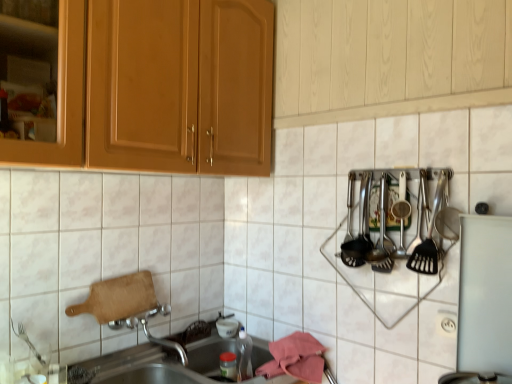
Question: Is white plastic electric outlet at lower right inside the boundaries of metallic stainless steel sink at lower left, or outside?

Choices:
 (A) inside
 (B) outside

Answer: (B)

Question: From a real-world perspective, relative to metallic stainless steel sink at lower left, is white plastic electric outlet at lower right vertically above or below?

Choices:
 (A) above
 (B) below

Answer: (A)

Question: Considering the real-world distances, which object is closest to the polished stainless steel utensils at right, the 1th silverware from the front?

Choices:
 (A) white plastic electric outlet at lower right
 (B) white glossy tile at upper center
 (C) metallic stainless steel sink at lower left
 (D) polished stainless steel utensils at right, which appears as the 1th silverware when viewed from the back

Answer: (D)

Question: Which of these objects is positioned closest to the metallic stainless steel sink at lower left?

Choices:
 (A) polished stainless steel utensils at right, which is the second silverware from left to right
 (B) white plastic electric outlet at lower right
 (C) white glossy tile at upper center
 (D) polished stainless steel utensils at right, which appears as the 1th silverware when viewed from the back

Answer: (C)